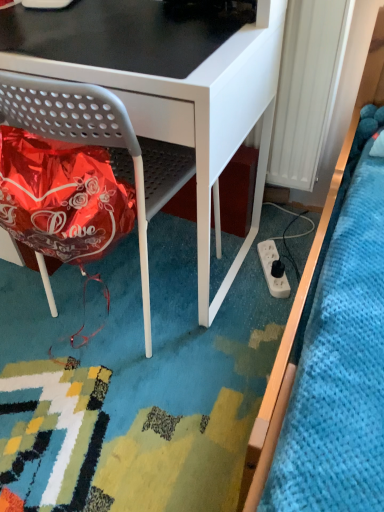
This screenshot has width=384, height=512. I want to click on vacant space that's between matte gray chair at lower left and white plastic power plugs and sockets at lower right, so click(x=228, y=291).